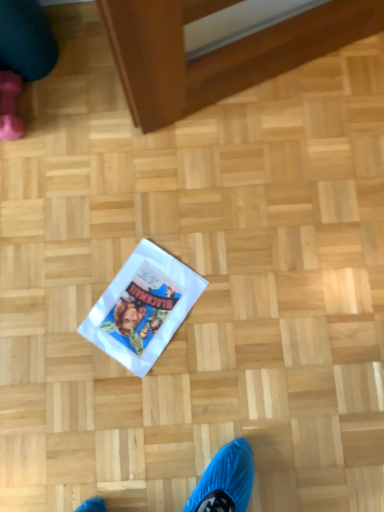
Question: Does teal fabric leg at upper left have a greater height compared to white paper flyer at center?

Choices:
 (A) yes
 (B) no

Answer: (A)

Question: Is white paper flyer at center inside teal fabric leg at upper left?

Choices:
 (A) no
 (B) yes

Answer: (A)

Question: Is teal fabric leg at upper left positioned far away from white paper flyer at center?

Choices:
 (A) no
 (B) yes

Answer: (A)

Question: Is teal fabric leg at upper left positioned behind white paper flyer at center?

Choices:
 (A) yes
 (B) no

Answer: (B)

Question: Is teal fabric leg at upper left outside white paper flyer at center?

Choices:
 (A) no
 (B) yes

Answer: (B)

Question: Is pink rubber boot at upper left wider or thinner than white paper flyer at center?

Choices:
 (A) wide
 (B) thin

Answer: (B)

Question: Visually, is pink rubber boot at upper left positioned to the left or to the right of white paper flyer at center?

Choices:
 (A) left
 (B) right

Answer: (A)

Question: Considering the positions of pink rubber boot at upper left and white paper flyer at center in the image, is pink rubber boot at upper left taller or shorter than white paper flyer at center?

Choices:
 (A) short
 (B) tall

Answer: (B)

Question: Does point (9, 94) appear closer or farther from the camera than point (162, 274)?

Choices:
 (A) closer
 (B) farther

Answer: (B)

Question: Is pink rubber boot at upper left in front of or behind teal fabric leg at upper left in the image?

Choices:
 (A) front
 (B) behind

Answer: (B)

Question: Considering the positions of pink rubber boot at upper left and teal fabric leg at upper left in the image, is pink rubber boot at upper left wider or thinner than teal fabric leg at upper left?

Choices:
 (A) thin
 (B) wide

Answer: (A)

Question: In terms of size, does pink rubber boot at upper left appear bigger or smaller than teal fabric leg at upper left?

Choices:
 (A) small
 (B) big

Answer: (A)

Question: In the image, is pink rubber boot at upper left on the left side or the right side of teal fabric leg at upper left?

Choices:
 (A) right
 (B) left

Answer: (B)

Question: From their relative heights in the image, would you say white paper flyer at center is taller or shorter than pink rubber boot at upper left?

Choices:
 (A) tall
 (B) short

Answer: (B)

Question: Visually, is white paper flyer at center positioned to the left or to the right of pink rubber boot at upper left?

Choices:
 (A) right
 (B) left

Answer: (A)